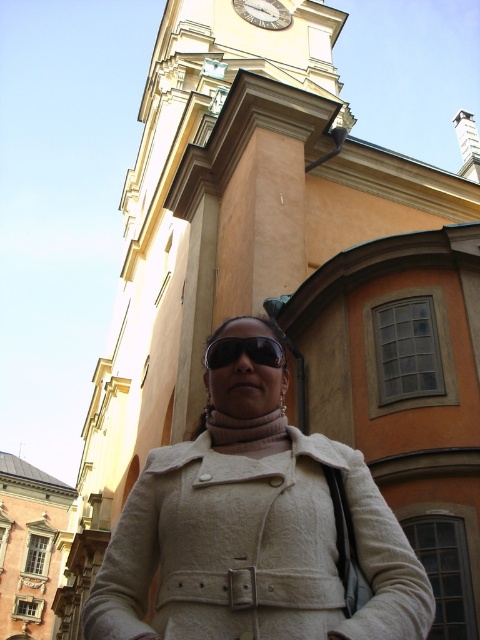
You are a photographer trying to capture the historic building. You notice the black reflective sunglasses at center might be causing glare in the photo. Where exactly are the black reflective sunglasses located in the image?

The black reflective sunglasses at center are located at point coordinates of 0.550 on the x axis and 0.508 on the y axis.

You are a photographer trying to capture the historic building with its clock tower. You notice the black reflective sunglasses at center and the metallic clock face at upper center in your frame. Which object is positioned lower in the image?

The black reflective sunglasses at center is positioned below the metallic clock face at upper center, so the sunglasses are lower in the image.

You are a photographer trying to capture both the black reflective sunglasses at center and the metallic clock face at upper center in a single shot. Which object will appear larger in the photo?

The metallic clock face at upper center will appear larger in the photo because it is larger in size compared to the black reflective sunglasses at center.